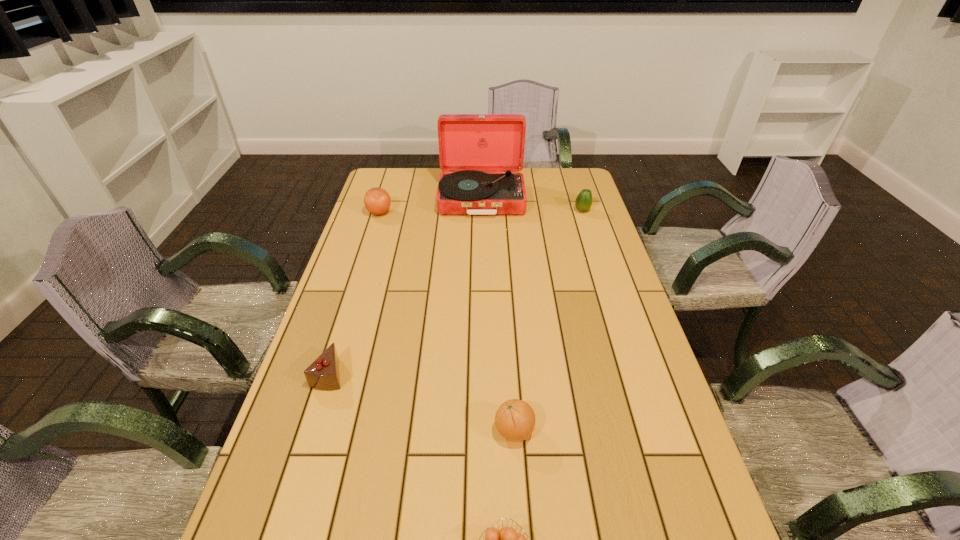
This screenshot has width=960, height=540. What are the coordinates of `free point between the fourth farthest object and the tallest object` in the screenshot? It's located at (405, 287).

The width and height of the screenshot is (960, 540). I want to click on vacant area between the leftmost orange fruit and the second tallest orange fruit, so click(447, 322).

In order to click on unoccupied area between the rightmost object and the second nearest orange fruit in this screenshot , I will do `click(548, 321)`.

You are a GUI agent. You are given a task and a screenshot of the screen. Output one action in this format:
    pyautogui.click(x=<x>, y=<y>)
    Task: Click on the free space between the chocolate cake and the avocado
    The height and width of the screenshot is (540, 960).
    Given the screenshot: What is the action you would take?
    pyautogui.click(x=456, y=292)

Identify the location of free spot between the tallest orange fruit and the third nearest object. The width and height of the screenshot is (960, 540). (354, 293).

The image size is (960, 540). I want to click on free space between the farthest orange fruit and the second shortest orange fruit, so click(447, 322).

You are a GUI agent. You are given a task and a screenshot of the screen. Output one action in this format:
    pyautogui.click(x=<x>, y=<y>)
    Task: Click on the object that is the fifth closest to the second nearest orange fruit
    The width and height of the screenshot is (960, 540).
    Given the screenshot: What is the action you would take?
    (x=377, y=201)

Choose which object is the nearest neighbor to the tallest object. Please provide its 2D coordinates. Your answer should be formatted as a tuple, i.e. [(x, y)], where the tuple contains the x and y coordinates of a point satisfying the conditions above.

[(377, 201)]

Locate which orange fruit is the second closest to the farthest orange fruit. Please provide its 2D coordinates. Your answer should be formatted as a tuple, i.e. [(x, y)], where the tuple contains the x and y coordinates of a point satisfying the conditions above.

[(507, 539)]

Select which orange fruit appears as the closest to the tallest object. Please provide its 2D coordinates. Your answer should be formatted as a tuple, i.e. [(x, y)], where the tuple contains the x and y coordinates of a point satisfying the conditions above.

[(377, 201)]